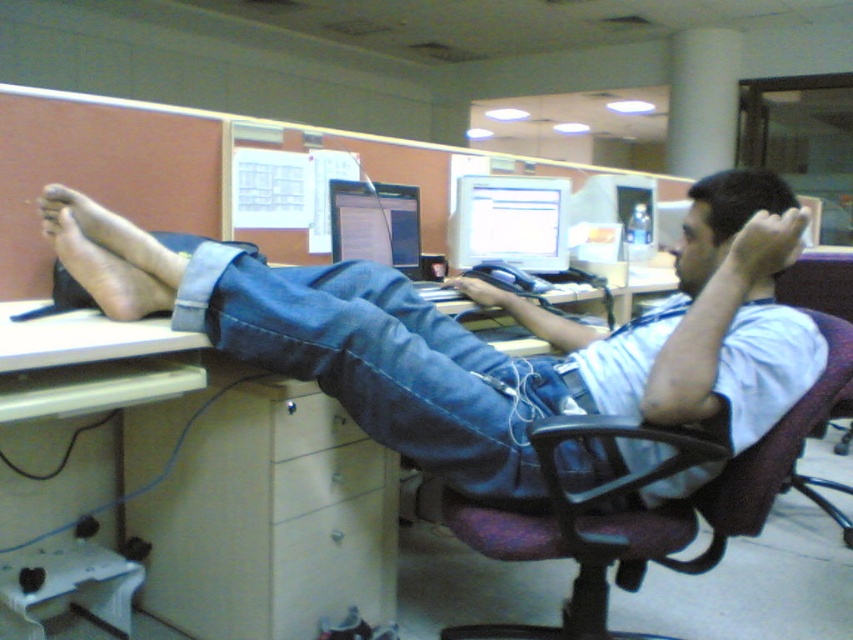
Who is taller, beige matte/file cabinet at lower center or denim at center?

With more height is beige matte/file cabinet at lower center.

Does beige matte/file cabinet at lower center have a lesser height compared to denim at center?

No.

Is point (260, 544) closer to viewer compared to point (415, 396)?

That is False.

Find the location of `beige matte/file cabinet at lower center`. beige matte/file cabinet at lower center is located at coordinates (259, 509).

Who is more distant from viewer, (662, 541) or (451, 244)?

Point (451, 244)

Does purple fabric swivel chair at center have a larger size compared to matte gray monitor at center?

Indeed, purple fabric swivel chair at center has a larger size compared to matte gray monitor at center.

Is point (802, 435) closer to camera compared to point (503, 189)?

Yes, it is in front of point (503, 189).

Find the location of a particular element. purple fabric swivel chair at center is located at coordinates (643, 509).

Is denim at center closer to camera compared to matte gray monitor at center?

Yes.

Can you confirm if denim at center is thinner than matte gray monitor at center?

Incorrect, denim at center's width is not less than matte gray monitor at center's.

What do you see at coordinates (384, 364) in the screenshot?
I see `denim at center` at bounding box center [384, 364].

Locate an element on the screen. The height and width of the screenshot is (640, 853). denim at center is located at coordinates (384, 364).